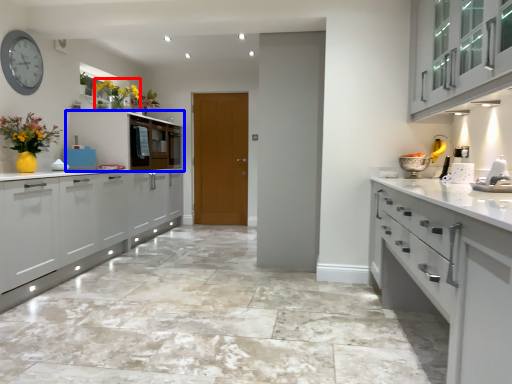
Question: Which object appears closest to the camera in this image, floral arrangement (highlighted by a red box) or cabinetry (highlighted by a blue box)?

Choices:
 (A) floral arrangement
 (B) cabinetry

Answer: (A)